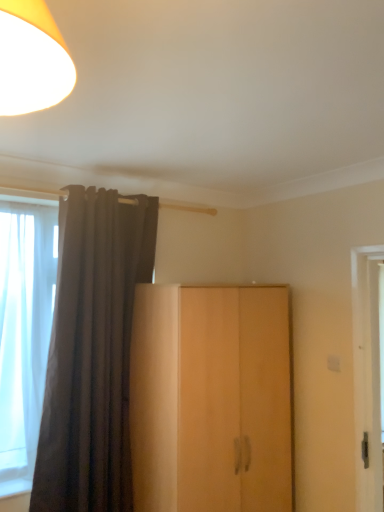
Where is `dark grey velvet curtain at left`? This screenshot has width=384, height=512. dark grey velvet curtain at left is located at coordinates click(92, 352).

The width and height of the screenshot is (384, 512). What do you see at coordinates (92, 352) in the screenshot?
I see `dark grey velvet curtain at left` at bounding box center [92, 352].

What is the approximate height of dark grey velvet curtain at left?

dark grey velvet curtain at left is 6.00 feet in height.

In order to click on light wood cupboard at center in this screenshot , I will do `click(211, 399)`.

This screenshot has width=384, height=512. Describe the element at coordinates (211, 399) in the screenshot. I see `light wood cupboard at center` at that location.

At what (x,y) coordinates should I click in order to perform the action: click on dark grey velvet curtain at left. Please return your answer as a coordinate pair (x, y). The image size is (384, 512). Looking at the image, I should click on [92, 352].

Considering the positions of objects dark grey velvet curtain at left and light wood cupboard at center in the image provided, who is more to the left, dark grey velvet curtain at left or light wood cupboard at center?

Positioned to the left is dark grey velvet curtain at left.

Which is in front, dark grey velvet curtain at left or light wood cupboard at center?

Positioned in front is light wood cupboard at center.

Considering the points (142, 276) and (147, 377), which point is behind, point (142, 276) or point (147, 377)?

Positioned behind is point (142, 276).

From the image's perspective, would you say dark grey velvet curtain at left is positioned over light wood cupboard at center?

Yes, from the image's perspective, dark grey velvet curtain at left is above light wood cupboard at center.

From a real-world perspective, who is located higher, dark grey velvet curtain at left or light wood cupboard at center?

dark grey velvet curtain at left.

Can you confirm if dark grey velvet curtain at left is wider than light wood cupboard at center?

In fact, dark grey velvet curtain at left might be narrower than light wood cupboard at center.

From their relative heights in the image, would you say dark grey velvet curtain at left is taller or shorter than light wood cupboard at center?

Considering their sizes, dark grey velvet curtain at left has more height than light wood cupboard at center.

Can you confirm if dark grey velvet curtain at left is smaller than light wood cupboard at center?

Yes, dark grey velvet curtain at left is smaller than light wood cupboard at center.

Is dark grey velvet curtain at left spatially inside light wood cupboard at center, or outside of it?

dark grey velvet curtain at left is not enclosed by light wood cupboard at center.

Is dark grey velvet curtain at left touching light wood cupboard at center?

No, dark grey velvet curtain at left is not next to light wood cupboard at center.

Could you tell me if dark grey velvet curtain at left is facing light wood cupboard at center?

No.

Can you tell me how much dark grey velvet curtain at left and light wood cupboard at center differ in facing direction?

The facing directions of dark grey velvet curtain at left and light wood cupboard at center are 0.367 degrees apart.

Measure the distance from dark grey velvet curtain at left to light wood cupboard at center.

The distance of dark grey velvet curtain at left from light wood cupboard at center is 17.56 inches.

You are a GUI agent. You are given a task and a screenshot of the screen. Output one action in this format:
    pyautogui.click(x=<x>, y=<y>)
    Task: Click on the cupboard that is on the right side of dark grey velvet curtain at left
    This screenshot has width=384, height=512.
    Given the screenshot: What is the action you would take?
    pyautogui.click(x=211, y=399)

Considering the relative positions of light wood cupboard at center and dark grey velvet curtain at left in the image provided, is light wood cupboard at center to the left of dark grey velvet curtain at left from the viewer's perspective?

In fact, light wood cupboard at center is to the right of dark grey velvet curtain at left.

In the image, is light wood cupboard at center positioned in front of or behind dark grey velvet curtain at left?

In the image, light wood cupboard at center appears in front of dark grey velvet curtain at left.

Considering the positions of points (173, 475) and (65, 213), is point (173, 475) closer to camera compared to point (65, 213)?

Yes, point (173, 475) is closer to viewer.

From the image's perspective, is light wood cupboard at center under dark grey velvet curtain at left?

Correct, light wood cupboard at center appears lower than dark grey velvet curtain at left in the image.

From a real-world perspective, between light wood cupboard at center and dark grey velvet curtain at left, who is vertically higher?

dark grey velvet curtain at left.

Which of these two, light wood cupboard at center or dark grey velvet curtain at left, is thinner?

Thinner between the two is dark grey velvet curtain at left.

Does light wood cupboard at center have a lesser height compared to dark grey velvet curtain at left?

Indeed, light wood cupboard at center has a lesser height compared to dark grey velvet curtain at left.

Can you confirm if light wood cupboard at center is bigger than dark grey velvet curtain at left?

Indeed, light wood cupboard at center has a larger size compared to dark grey velvet curtain at left.

Is light wood cupboard at center outside of dark grey velvet curtain at left?

light wood cupboard at center is positioned outside dark grey velvet curtain at left.

Is light wood cupboard at center next to dark grey velvet curtain at left?

light wood cupboard at center and dark grey velvet curtain at left are not in contact.

Is light wood cupboard at center aimed at dark grey velvet curtain at left?

No, light wood cupboard at center is not aimed at dark grey velvet curtain at left.

Locate an element on the screen. The width and height of the screenshot is (384, 512). curtain on the left of light wood cupboard at center is located at coordinates (92, 352).

Find the location of a particular element. This screenshot has height=512, width=384. curtain behind the light wood cupboard at center is located at coordinates (92, 352).

Identify the location of cupboard below the dark grey velvet curtain at left (from the image's perspective). (211, 399).